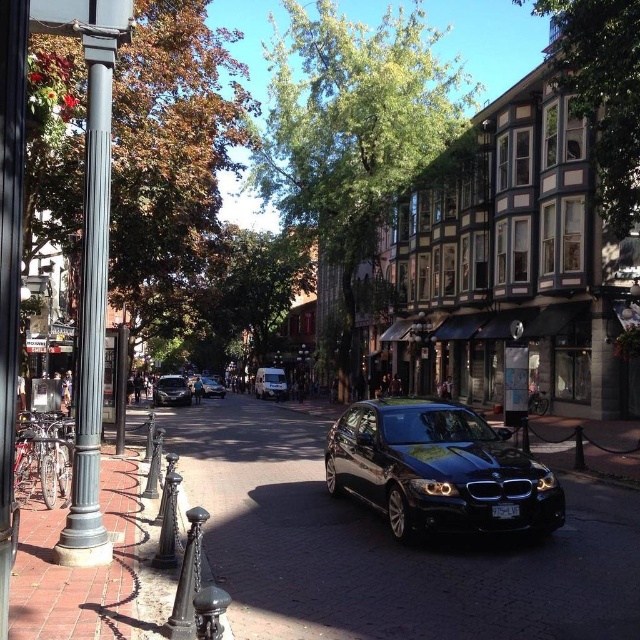
Does brick pavement at center have a smaller size compared to black glass lamp post at center?

Incorrect, brick pavement at center is not smaller in size than black glass lamp post at center.

Is brick pavement at center above black glass lamp post at center?

Actually, brick pavement at center is below black glass lamp post at center.

I want to click on brick pavement at center, so click(x=385, y=547).

Identify the location of brick pavement at center. The width and height of the screenshot is (640, 640). (385, 547).

Is point (541, 532) farther from viewer compared to point (301, 346)?

No, it is in front of (301, 346).

Locate an element on the screen. The image size is (640, 640). glossy black car at center is located at coordinates (438, 470).

Is glossy black car at center shorter than black glass lamp post at center?

Yes, glossy black car at center is shorter than black glass lamp post at center.

Looking at this image, who is more forward, (x=333, y=481) or (x=413, y=387)?

Point (x=333, y=481)

Who is more distant from viewer, (484, 522) or (420, 320)?

The point (420, 320) is behind.

At what (x,y) coordinates should I click in order to perform the action: click on glossy black car at center. Please return your answer as a coordinate pair (x, y). This screenshot has width=640, height=640. Looking at the image, I should click on (438, 470).